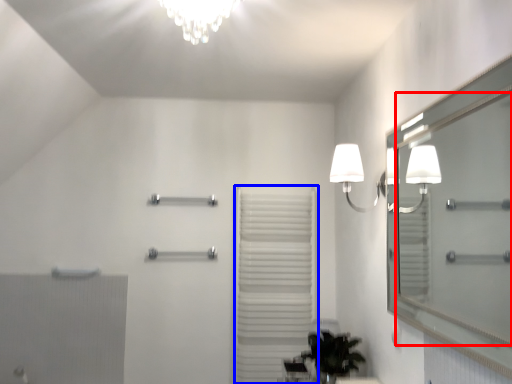
Question: Among these objects, which one is farthest to the camera, mirror (highlighted by a red box) or curtain (highlighted by a blue box)?

Choices:
 (A) mirror
 (B) curtain

Answer: (B)